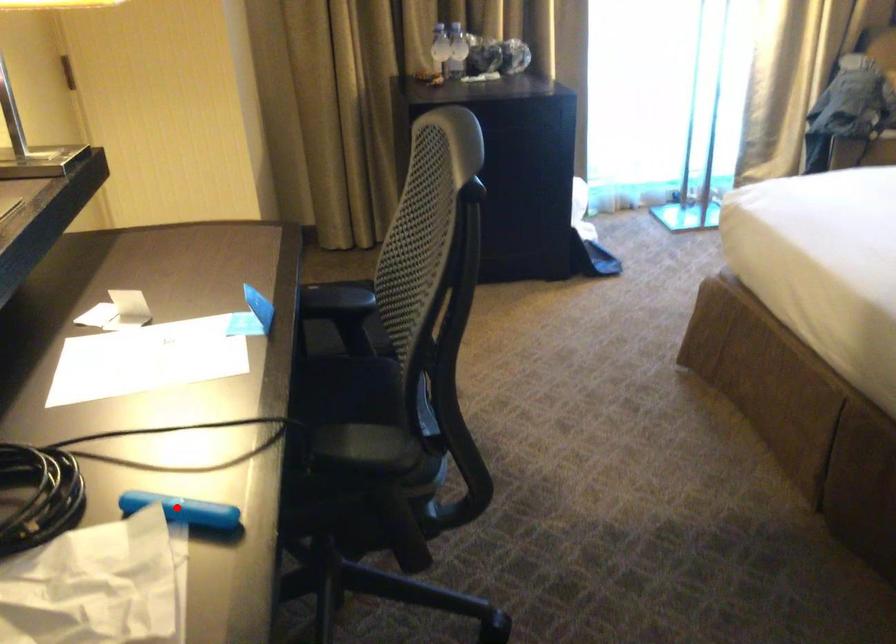
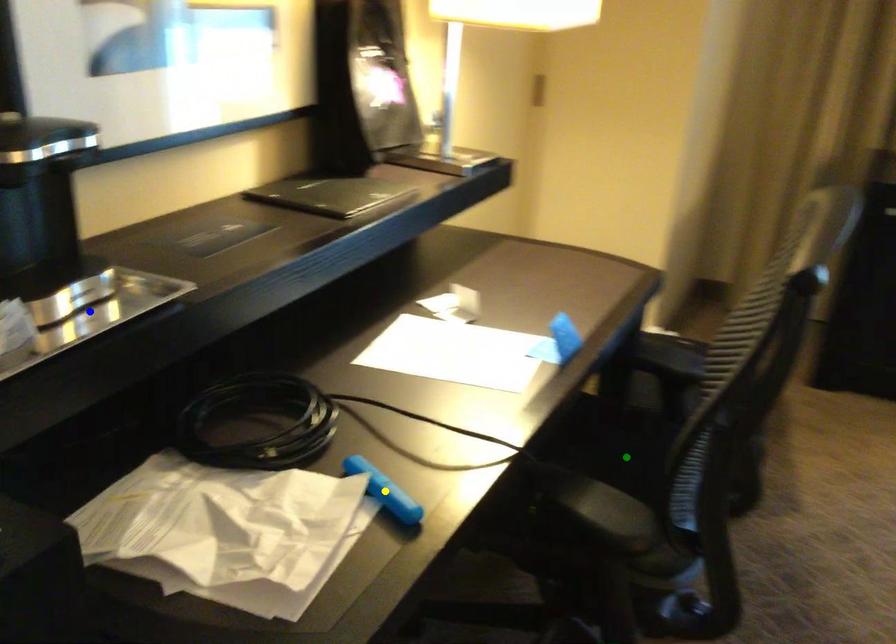
Question: I am providing you with two images of the same scene from different viewpoints. A red point is marked on the first image. You are given multiple points on the second image. Which mark in image 2 goes with the point in image 1?

Choices:
 (A) yellow point
 (B) green point
 (C) blue point

Answer: (A)